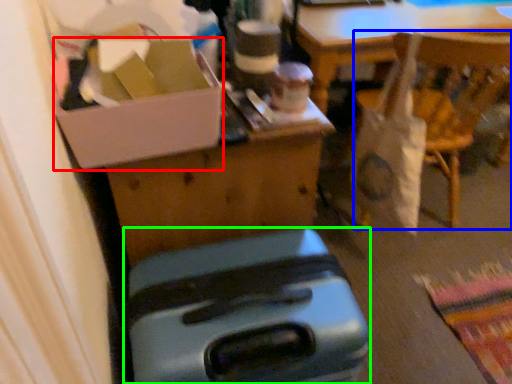
Question: Which object is positioned farthest from box (highlighted by a red box)? Select from chair (highlighted by a blue box) and luggage (highlighted by a green box).

Choices:
 (A) chair
 (B) luggage

Answer: (A)